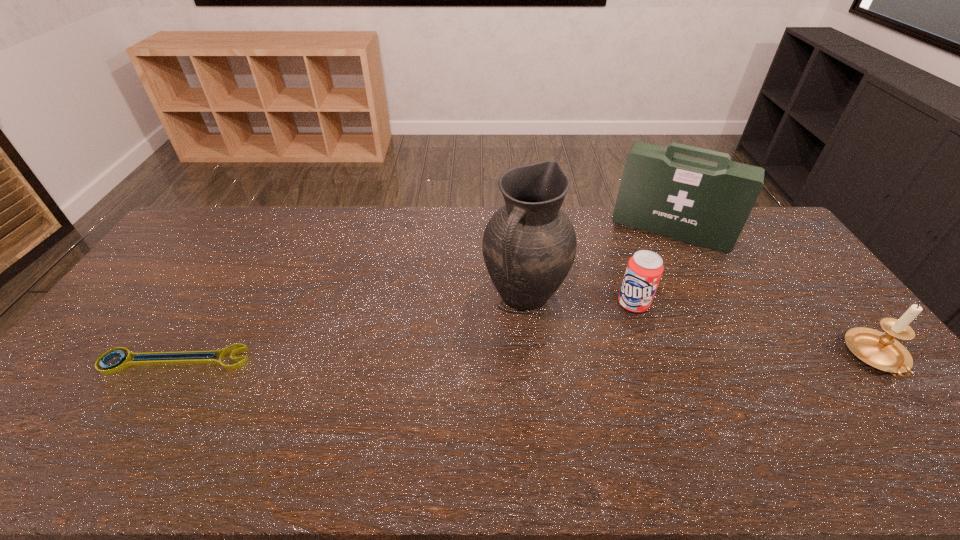
Identify the location of vacant space located 0.390m on the surface of the soda can. The image size is (960, 540). (523, 374).

Locate an element on the screen. This screenshot has height=540, width=960. free space located 0.400m on the surface of the soda can is located at coordinates (520, 376).

The height and width of the screenshot is (540, 960). I want to click on vacant space situated on the surface of the soda can, so click(x=605, y=322).

Where is `free space located on the side of the tallest object with the handle`? The width and height of the screenshot is (960, 540). free space located on the side of the tallest object with the handle is located at coordinates (451, 404).

Image resolution: width=960 pixels, height=540 pixels. I want to click on vacant space situated 0.310m on the side of the tallest object with the handle, so click(x=449, y=407).

Identify the location of free location located 0.260m on the side of the tallest object with the handle. The height and width of the screenshot is (540, 960). (460, 392).

Image resolution: width=960 pixels, height=540 pixels. I want to click on blank space located 0.340m on the front-facing side of the first-aid kit, so click(x=630, y=316).

I want to click on free space located 0.370m on the front-facing side of the first-aid kit, so click(627, 323).

Find the location of `free region located 0.160m on the front-facing side of the first-aid kit`. free region located 0.160m on the front-facing side of the first-aid kit is located at coordinates (643, 280).

Locate an element on the screen. The height and width of the screenshot is (540, 960). object situated at the far edge is located at coordinates (704, 203).